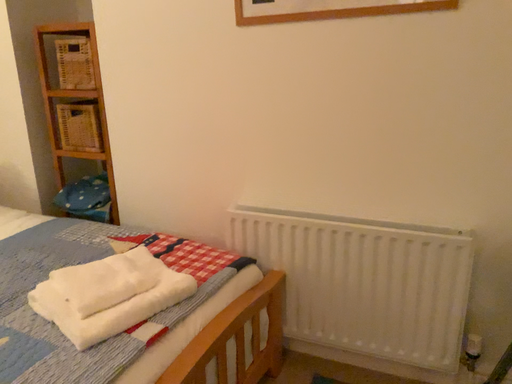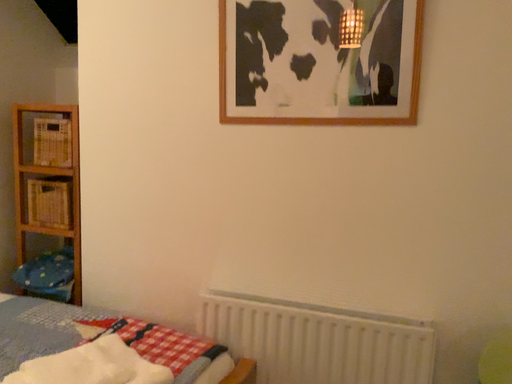
Question: How did the camera likely rotate when shooting the video?

Choices:
 (A) rotated right
 (B) rotated left

Answer: (A)